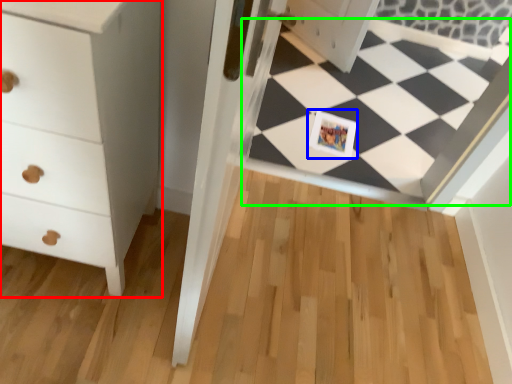
Question: Estimate the real-world distances between objects in this image. Which object is closer to chest of drawers (highlighted by a red box), postcard (highlighted by a blue box) or square (highlighted by a green box)?

Choices:
 (A) postcard
 (B) square

Answer: (A)